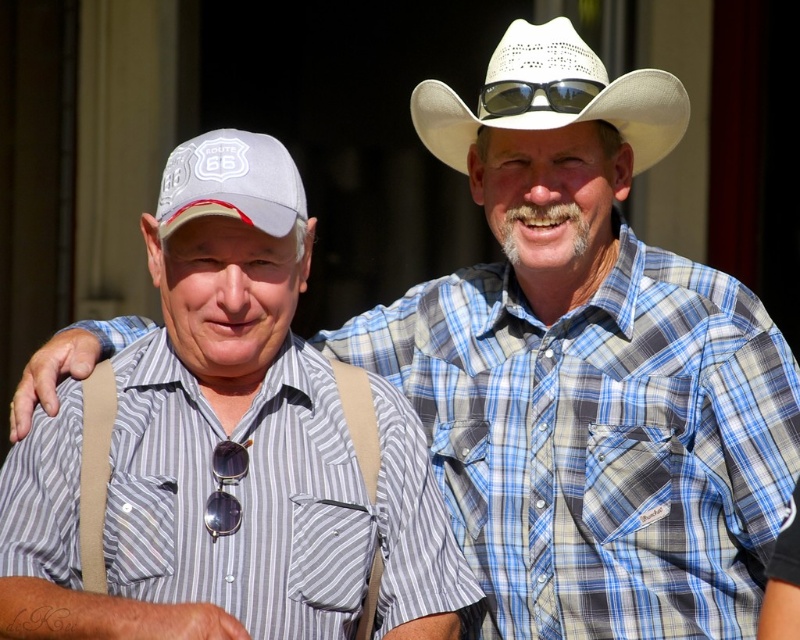
You are a photographer trying to capture both the white fabric baseball cap at left and the sunglasses at center in a single frame. Given their sizes, which object should you focus on to ensure both fit in the photo?

Since the white fabric baseball cap at left is smaller than the sunglasses at center, you should focus on the sunglasses at center to ensure both fit in the photo.

You are a photographer trying to capture a clear photo of the sunglasses at center and the white woven cowboy hat at upper center. Which object should you focus on first to ensure both are in focus?

The white woven cowboy hat at upper center is closer to the viewer than the sunglasses at center. To ensure both are in focus, you should focus on the sunglasses at center first since it is farther away, allowing the depth of field to cover both objects.